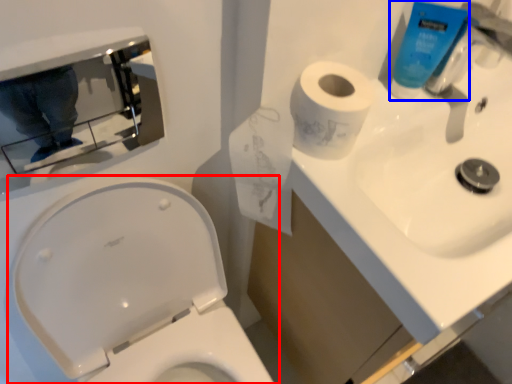
Question: Which point is closer to the camera, toilet (highlighted by a red box) or cleaning product (highlighted by a blue box)?

Choices:
 (A) toilet
 (B) cleaning product

Answer: (A)